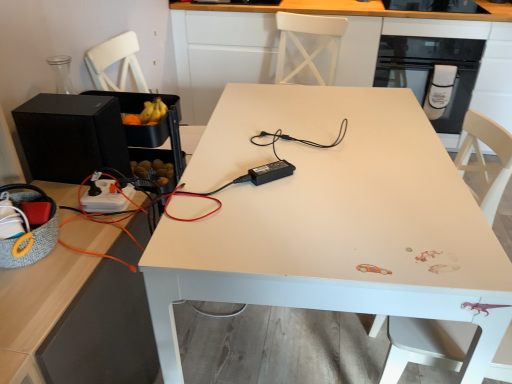
The image size is (512, 384). In order to click on vacant area in front of black plastic power adapter at center, positioned as the first appliance in front-to-back order in this screenshot , I will do `click(276, 214)`.